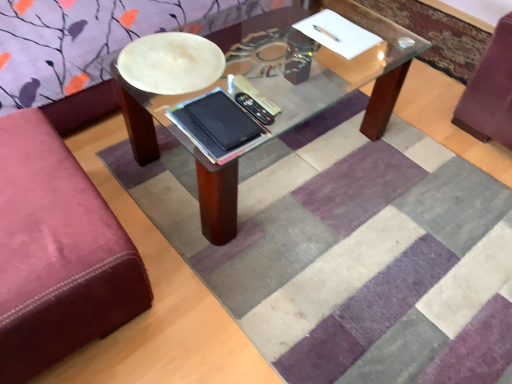
Question: Is black matte tablet at center to the right of striped rug at center from the viewer's perspective?

Choices:
 (A) no
 (B) yes

Answer: (A)

Question: From the image's perspective, is black matte tablet at center located beneath striped rug at center?

Choices:
 (A) no
 (B) yes

Answer: (A)

Question: From the image's perspective, is black matte tablet at center on striped rug at center?

Choices:
 (A) no
 (B) yes

Answer: (B)

Question: Is there a large distance between black matte tablet at center and striped rug at center?

Choices:
 (A) yes
 (B) no

Answer: (B)

Question: Does black matte tablet at center have a larger size compared to striped rug at center?

Choices:
 (A) no
 (B) yes

Answer: (A)

Question: From a real-world perspective, relative to velvet maroon ottoman at left, is black matte tablet at center vertically above or below?

Choices:
 (A) above
 (B) below

Answer: (A)

Question: Is black matte tablet at center wider or thinner than velvet maroon ottoman at left?

Choices:
 (A) thin
 (B) wide

Answer: (A)

Question: Considering the positions of point (218, 96) and point (24, 203), is point (218, 96) closer or farther from the camera than point (24, 203)?

Choices:
 (A) farther
 (B) closer

Answer: (A)

Question: Choose the correct answer: Is black matte tablet at center inside velvet maroon ottoman at left or outside it?

Choices:
 (A) inside
 (B) outside

Answer: (B)

Question: From the image's perspective, is black matte tablet at center above or below striped rug at center?

Choices:
 (A) below
 (B) above

Answer: (B)

Question: Is point (220, 112) positioned closer to the camera than point (297, 152)?

Choices:
 (A) farther
 (B) closer

Answer: (B)

Question: From a real-world perspective, is black matte tablet at center positioned above or below striped rug at center?

Choices:
 (A) below
 (B) above

Answer: (B)

Question: Is black matte tablet at center in front of or behind striped rug at center in the image?

Choices:
 (A) behind
 (B) front

Answer: (A)

Question: Which is correct: velvet maroon ottoman at left is inside black matte tablet at center, or outside of it?

Choices:
 (A) outside
 (B) inside

Answer: (A)

Question: Considering their positions, is velvet maroon ottoman at left located in front of or behind black matte tablet at center?

Choices:
 (A) front
 (B) behind

Answer: (A)